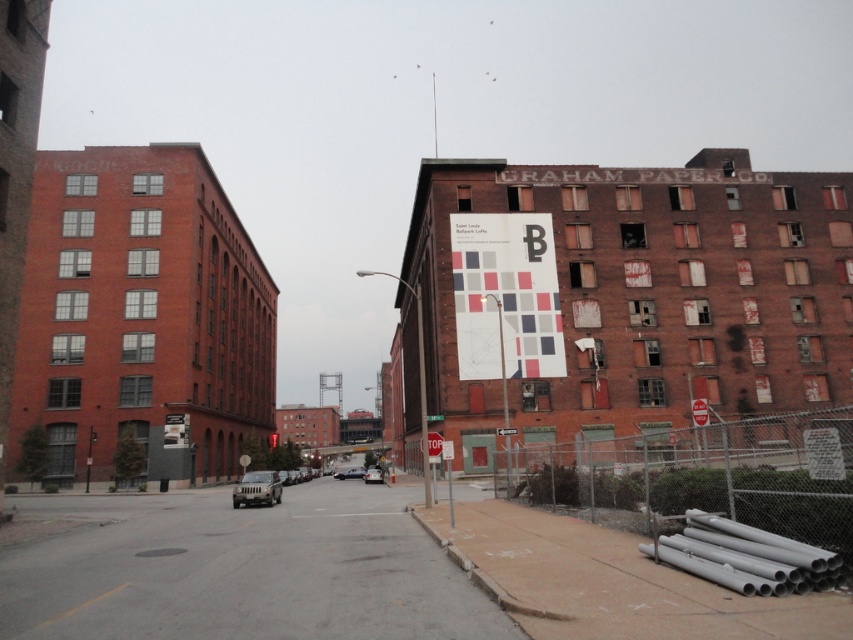
From the picture: Is gray chain-link fence at lower right to the left of red paper sign at center from the viewer's perspective?

No, gray chain-link fence at lower right is not to the left of red paper sign at center.

Can you confirm if gray chain-link fence at lower right is wider than red paper sign at center?

Correct, the width of gray chain-link fence at lower right exceeds that of red paper sign at center.

From the picture: Who is more forward, (x=625, y=468) or (x=436, y=452)?

Point (x=625, y=468) is in front.

The width and height of the screenshot is (853, 640). I want to click on gray chain-link fence at lower right, so click(708, 476).

Measure the distance from white paper sign at upper center to matte silver suv at center.

A distance of 81.95 feet exists between white paper sign at upper center and matte silver suv at center.

Does white paper sign at upper center have a greater width compared to matte silver suv at center?

Incorrect, white paper sign at upper center's width does not surpass matte silver suv at center's.

Between point (467, 243) and point (271, 476), which one is positioned behind?

The point (467, 243) is more distant.

Find the location of a particular element. white paper sign at upper center is located at coordinates (505, 296).

You are a GUI agent. You are given a task and a screenshot of the screen. Output one action in this format:
    pyautogui.click(x=<x>, y=<y>)
    Task: Click on the white paper sign at upper center
    The image size is (853, 640).
    Given the screenshot: What is the action you would take?
    pyautogui.click(x=505, y=296)

From the picture: Which of these two, white paper sign at upper center or red paper sign at center, stands shorter?

Standing shorter between the two is red paper sign at center.

Where is `white paper sign at upper center`? This screenshot has height=640, width=853. white paper sign at upper center is located at coordinates (505, 296).

Where is `white paper sign at upper center`? The height and width of the screenshot is (640, 853). white paper sign at upper center is located at coordinates (505, 296).